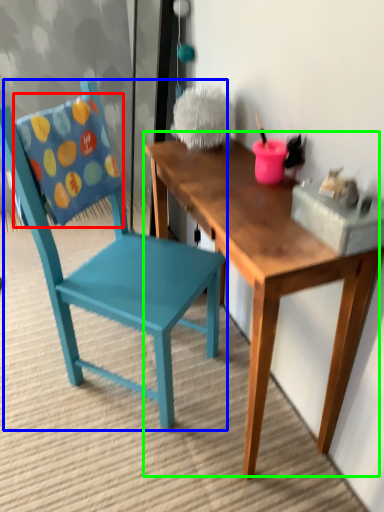
Question: Which object is the closest to the pillow (highlighted by a red box)? Choose among these: chair (highlighted by a blue box) or table (highlighted by a green box).

Choices:
 (A) chair
 (B) table

Answer: (A)